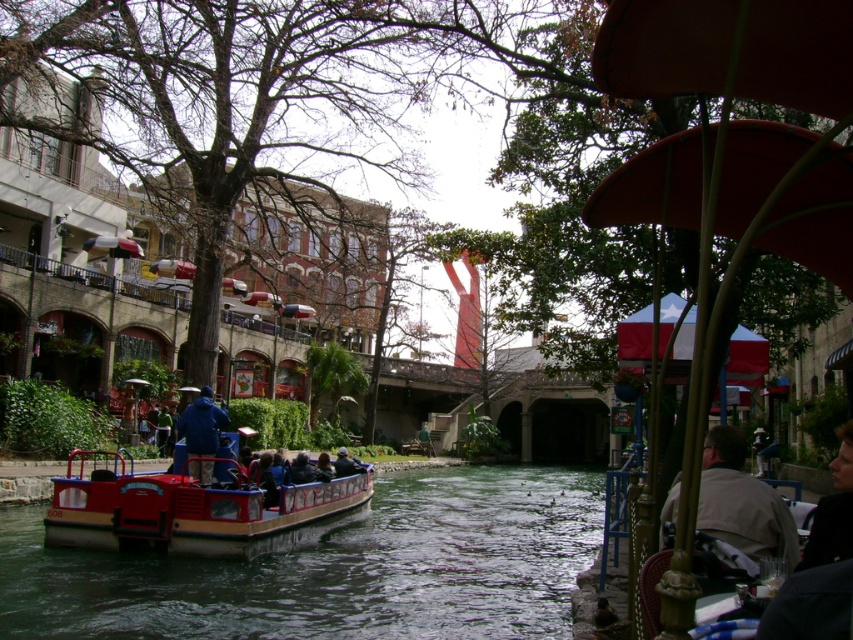
Question: Can you confirm if red plastic boat at center is positioned to the left of light brown leather jacket at lower right?

Choices:
 (A) no
 (B) yes

Answer: (B)

Question: Which point appears farthest from the camera in this image?

Choices:
 (A) (352, 474)
 (B) (286, 474)
 (C) (737, 508)
 (D) (129, 488)

Answer: (A)

Question: Which object is closer to the camera taking this photo?

Choices:
 (A) smooth dark water at center
 (B) red plastic boat at center

Answer: (A)

Question: Can you confirm if red plastic boat at center is positioned to the right of dark blue jacket at center?

Choices:
 (A) no
 (B) yes

Answer: (A)

Question: Can you confirm if red plastic boat at center is thinner than light brown leather jacket at lower right?

Choices:
 (A) no
 (B) yes

Answer: (A)

Question: Which point is closer to the camera taking this photo?

Choices:
 (A) click(343, 451)
 (B) click(279, 625)

Answer: (B)